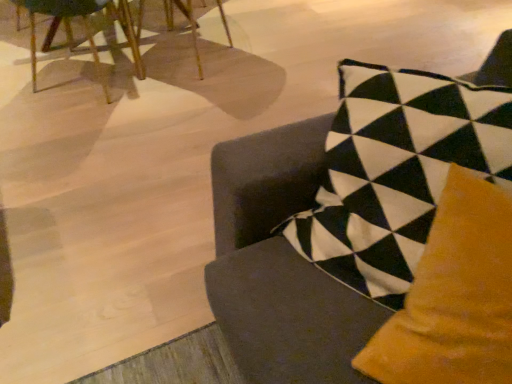
Question: Does velvet cushion at center, marked as the first chair in a right-to-left arrangement, appear on the right side of wooden chair at upper left, which is the third chair in right-to-left order?

Choices:
 (A) yes
 (B) no

Answer: (A)

Question: Considering the relative sizes of velvet cushion at center, the third chair positioned from the left, and wooden chair at upper left, which is counted as the first chair, starting from the left, in the image provided, is velvet cushion at center, the third chair positioned from the left, shorter than wooden chair at upper left, which is counted as the first chair, starting from the left,?

Choices:
 (A) no
 (B) yes

Answer: (A)

Question: Is velvet cushion at center, marked as the first chair in a right-to-left arrangement, to the left of wooden chair at upper left, which is the third chair in right-to-left order, from the viewer's perspective?

Choices:
 (A) no
 (B) yes

Answer: (A)

Question: Does velvet cushion at center, the third chair positioned from the left, have a smaller size compared to wooden chair at upper left, which is counted as the first chair, starting from the left?

Choices:
 (A) no
 (B) yes

Answer: (A)

Question: Could you tell me if velvet cushion at center, marked as the first chair in a right-to-left arrangement, is facing wooden chair at upper left, which is the third chair in right-to-left order?

Choices:
 (A) no
 (B) yes

Answer: (A)

Question: Would you consider wooden chair at upper left, the 2th chair viewed from the right, to be distant from velvet cushion at center, the third chair positioned from the left?

Choices:
 (A) yes
 (B) no

Answer: (A)

Question: From the image's perspective, would you say wooden chair at upper left, positioned as the third chair in front-to-back order, is shown under velvet cushion at center, the third chair positioned from the left?

Choices:
 (A) no
 (B) yes

Answer: (A)

Question: Is wooden chair at upper left, the 2th chair viewed from the right, facing away from velvet cushion at center, which ranks as the 1th chair in front-to-back order?

Choices:
 (A) no
 (B) yes

Answer: (A)

Question: Is wooden chair at upper left, the 2th chair in the left-to-right sequence, closer to camera compared to velvet cushion at center, the third chair positioned from the left?

Choices:
 (A) no
 (B) yes

Answer: (A)

Question: Can you confirm if wooden chair at upper left, positioned as the third chair in front-to-back order, is shorter than velvet cushion at center, marked as the first chair in a right-to-left arrangement?

Choices:
 (A) no
 (B) yes

Answer: (B)

Question: From a real-world perspective, is wooden chair at upper left, positioned as the third chair in front-to-back order, located beneath velvet cushion at center, marked as the first chair in a right-to-left arrangement?

Choices:
 (A) no
 (B) yes

Answer: (B)

Question: From the image's perspective, is wooden chair at upper left, the 2th chair viewed from the right, located above wooden chair at upper left, which is counted as the first chair, starting from the left?

Choices:
 (A) yes
 (B) no

Answer: (A)